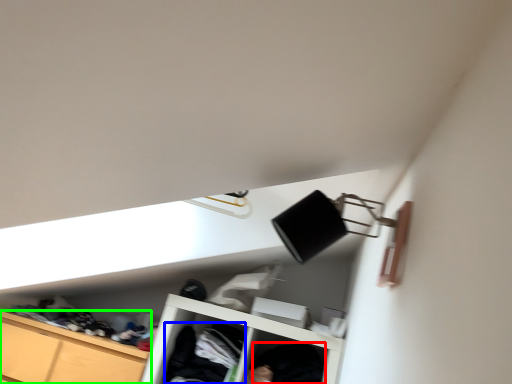
Question: Which is nearer to the clothing (highlighted by a red box)? clothing (highlighted by a blue box) or cabinetry (highlighted by a green box).

Choices:
 (A) clothing
 (B) cabinetry

Answer: (A)